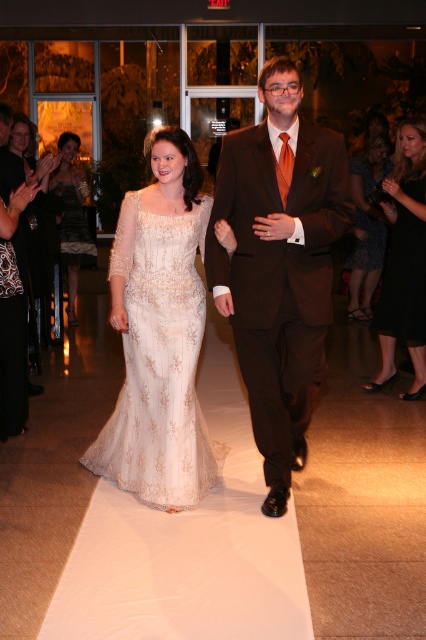
You are a photographer at the wedding and want to capture a closeup shot of the printed fabric dress at right. Based on its coordinates, where should you position your camera to focus?

The printed fabric dress at right is located at coordinates point (367, 225), so you should position your camera to focus on that point.

You are a photographer at a wedding reception. You need to position two bridesmaids in a photo. The bridesmaids are wearing the printed fabric dress at right and the shiny gold dress at left. Given their dresses, which bridesmaid should stand closer to the camera to ensure both are fully visible in the photo?

The printed fabric dress at right has a larger width than the shiny gold dress at left. To ensure both are fully visible, the bridesmaid in the printed fabric dress at right should stand closer to the camera so that her wider dress fits within the frame.